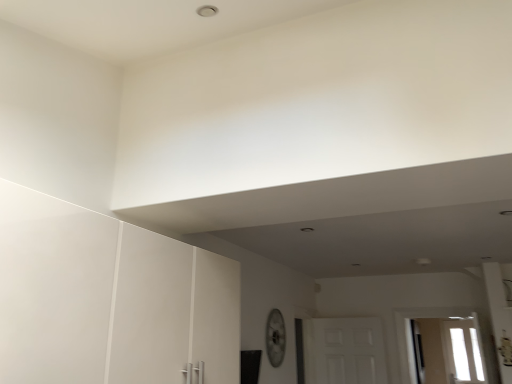
Measure the distance between transparent glass window at lower right and camera.

transparent glass window at lower right and camera are 13.51 feet apart.

At what (x,y) coordinates should I click in order to perform the action: click on transparent glass window at lower right. Please return your answer as a coordinate pair (x, y). Looking at the image, I should click on (463, 351).

Describe the element at coordinates (463, 351) in the screenshot. Image resolution: width=512 pixels, height=384 pixels. I see `transparent glass window at lower right` at that location.

The width and height of the screenshot is (512, 384). Find the location of `white matte door at center`. white matte door at center is located at coordinates (346, 351).

Describe the element at coordinates (346, 351) in the screenshot. Image resolution: width=512 pixels, height=384 pixels. I see `white matte door at center` at that location.

At what (x,y) coordinates should I click in order to perform the action: click on transparent glass window at lower right. Please return your answer as a coordinate pair (x, y). Looking at the image, I should click on coord(463,351).

Does transparent glass window at lower right appear on the right side of white matte door at center?

Yes, transparent glass window at lower right is to the right of white matte door at center.

Does transparent glass window at lower right come behind white matte door at center?

Yes, transparent glass window at lower right is behind white matte door at center.

Does point (476, 370) come behind point (377, 347)?

No.

From the image's perspective, which is below, transparent glass window at lower right or white matte door at center?

From the image's view, transparent glass window at lower right is below.

From a real-world perspective, is transparent glass window at lower right located beneath white matte door at center?

Correct, in the physical world, transparent glass window at lower right is lower than white matte door at center.

Which object is wider, transparent glass window at lower right or white matte door at center?

Wider between the two is white matte door at center.

Considering the sizes of objects transparent glass window at lower right and white matte door at center in the image provided, who is taller, transparent glass window at lower right or white matte door at center?

With more height is transparent glass window at lower right.

Is transparent glass window at lower right smaller than white matte door at center?

Yes, transparent glass window at lower right is smaller than white matte door at center.

Is transparent glass window at lower right completely or partially outside of white matte door at center?

That's correct, transparent glass window at lower right is outside of white matte door at center.

Consider the image. Are transparent glass window at lower right and white matte door at center making contact?

There is a gap between transparent glass window at lower right and white matte door at center.

Is transparent glass window at lower right aimed at white matte door at center?

Yes, transparent glass window at lower right faces towards white matte door at center.

This screenshot has width=512, height=384. Identify the location of window that appears below the white matte door at center (from the image's perspective). [463, 351].

Which is more to the left, white matte door at center or transparent glass window at lower right?

Positioned to the left is white matte door at center.

Is the depth of white matte door at center greater than that of transparent glass window at lower right?

No, white matte door at center is closer to the viewer.

Which point is more forward, (x=338, y=356) or (x=471, y=337)?

Point (x=471, y=337)

From the image's perspective, which one is positioned higher, white matte door at center or transparent glass window at lower right?

From the image's view, white matte door at center is above.

From a real-world perspective, between white matte door at center and transparent glass window at lower right, who is vertically lower?

transparent glass window at lower right is physically lower.

Between white matte door at center and transparent glass window at lower right, which one has larger width?

white matte door at center is wider.

Who is shorter, white matte door at center or transparent glass window at lower right?

white matte door at center.

Does white matte door at center have a larger size compared to transparent glass window at lower right?

Yes.

Is transparent glass window at lower right surrounded by white matte door at center?

No, transparent glass window at lower right is not surrounded by white matte door at center.

Does white matte door at center touch transparent glass window at lower right?

No, white matte door at center is not touching transparent glass window at lower right.

Is white matte door at center aimed at transparent glass window at lower right?

No, white matte door at center is not facing towards transparent glass window at lower right.

Identify the location of window that appears on the right of white matte door at center. (463, 351).

The width and height of the screenshot is (512, 384). What are the coordinates of `door on the left of transparent glass window at lower right` in the screenshot? It's located at (346, 351).

Find the location of a particular element. This screenshot has width=512, height=384. window behind the white matte door at center is located at coordinates (463, 351).